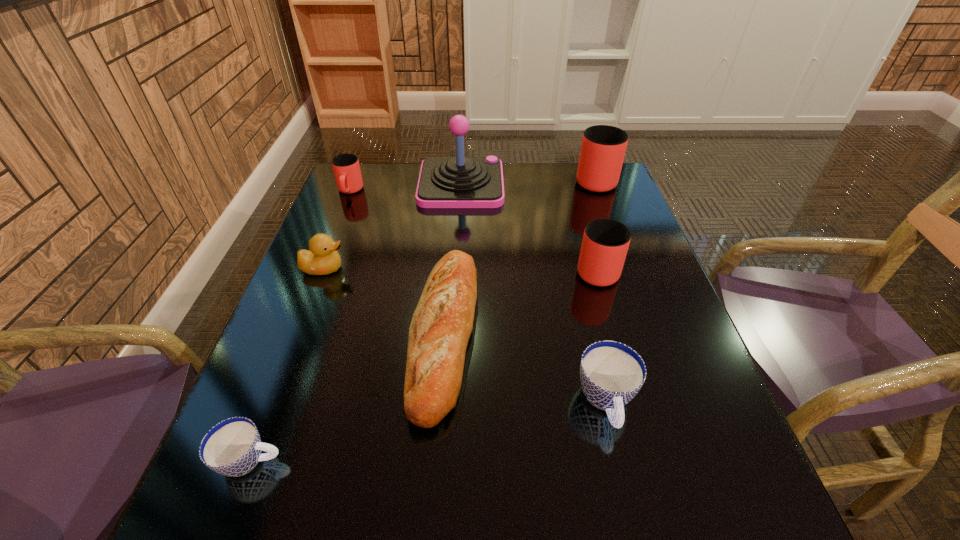
Find the location of `the left blue cup`. the left blue cup is located at coordinates (232, 447).

Image resolution: width=960 pixels, height=540 pixels. In order to click on the shortest cup in this screenshot , I will do `click(232, 447)`.

Locate an element on the screen. This screenshot has height=540, width=960. vacant space situated forward from the base of the tallest object is located at coordinates point(586,185).

Image resolution: width=960 pixels, height=540 pixels. Identify the location of vacant space located 0.300m on the handle side of the third tallest object. (572, 186).

Find the location of `vacant region located on the handle side of the third tallest object`. vacant region located on the handle side of the third tallest object is located at coordinates (580, 211).

This screenshot has height=540, width=960. What are the coordinates of `free point located 0.350m on the handle side of the third tallest object` in the screenshot? It's located at (570, 178).

Locate an element on the screen. This screenshot has height=540, width=960. free space located facing forward on the duckling is located at coordinates (425, 268).

Identify the location of free space located on the handle side of the smallest pink cup. This screenshot has width=960, height=540. (323, 260).

Where is `vacant region located on the left of the baguet`? This screenshot has width=960, height=540. vacant region located on the left of the baguet is located at coordinates (281, 333).

This screenshot has width=960, height=540. Find the location of `free space located 0.070m on the side of the bigger blue cup with the handle`. free space located 0.070m on the side of the bigger blue cup with the handle is located at coordinates (625, 482).